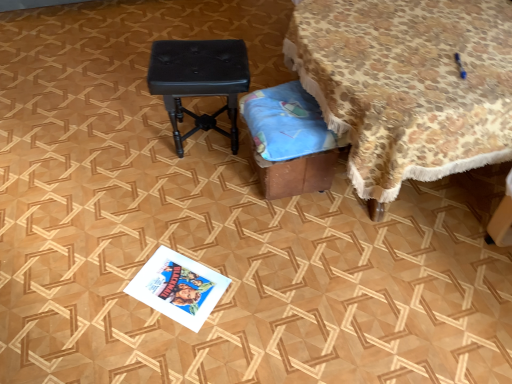
Where is `free space in front of brown cardboard box at lower center`? The height and width of the screenshot is (384, 512). free space in front of brown cardboard box at lower center is located at coordinates (293, 238).